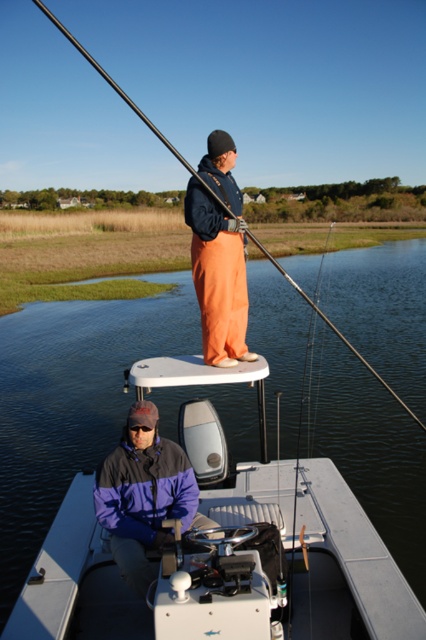
You are standing on the deck of a ship and need to reach a point marked at coordinates point (152, 452). If your maximum reach is 3.5 meters, can you comfortably reach that point without moving?

The distance of point (152, 452) from camera is 3.66 meters, so you cannot comfortably reach that point as it is beyond your 3.5 meters reach.